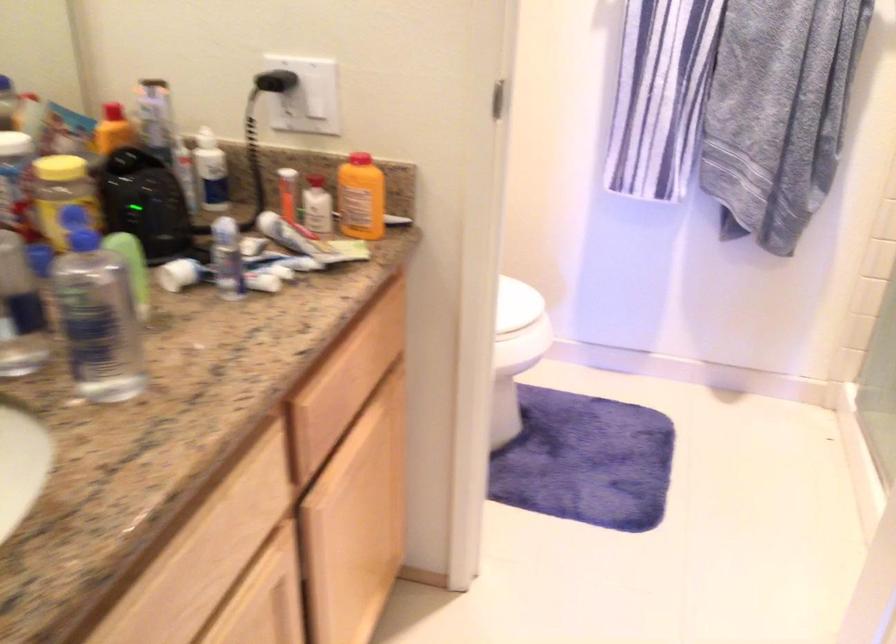
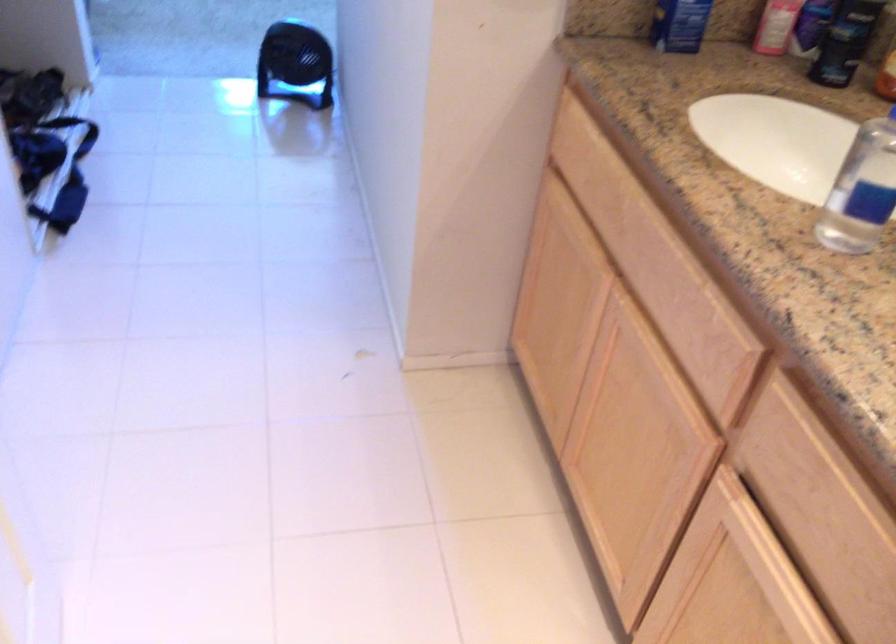
Find the pixel in the second image that matches (341,467) in the first image.

(754, 536)